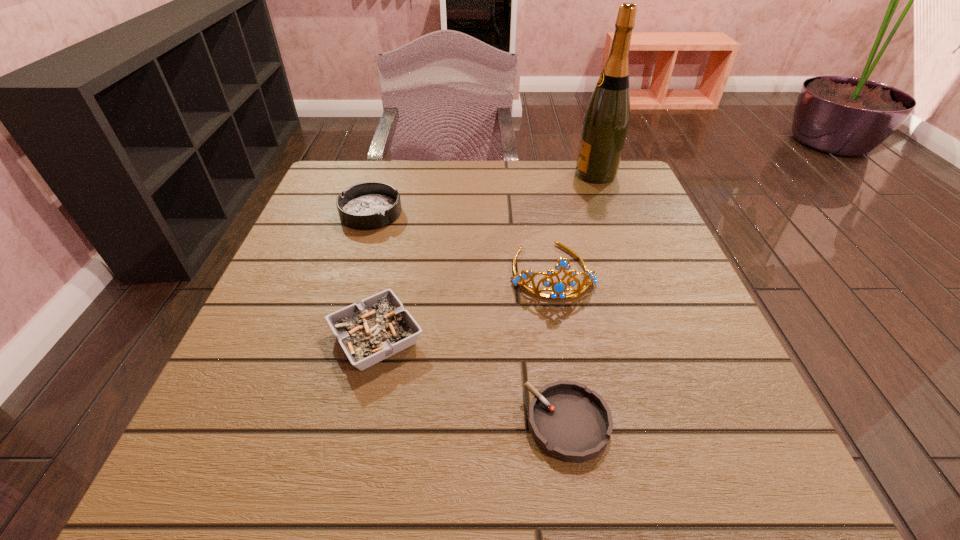
Locate an element on the screen. The image size is (960, 540). ashtray that is the closest to the nearest ashtray is located at coordinates (378, 327).

Identify the location of ashtray identified as the third closest to the fourth shortest object. (371, 205).

Identify the location of vacant space that satisfies the following two spatial constraints: 1. on the front-facing side of the rightmost object; 2. on the front side of the second farthest ashtray. The height and width of the screenshot is (540, 960). (657, 338).

Find the location of a particular element. free location that satisfies the following two spatial constraints: 1. on the front-facing side of the wine bottle; 2. on the front-facing side of the tiara is located at coordinates (633, 272).

You are a GUI agent. You are given a task and a screenshot of the screen. Output one action in this format:
    pyautogui.click(x=<x>, y=<y>)
    Task: Click on the vacant space that satisfies the following two spatial constraints: 1. on the front-facing side of the tallest object; 2. on the front-facing side of the fourth shortest object
    The height and width of the screenshot is (540, 960).
    Given the screenshot: What is the action you would take?
    pyautogui.click(x=633, y=272)

Where is `free space that satisfies the following two spatial constraints: 1. on the front-facing side of the wine bottle; 2. on the front-facing side of the tiara`? free space that satisfies the following two spatial constraints: 1. on the front-facing side of the wine bottle; 2. on the front-facing side of the tiara is located at coordinates (633, 272).